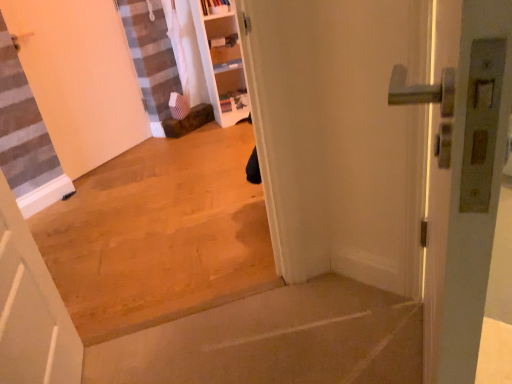
Question: From a real-world perspective, relative to white matte door at lower left, the second door from the right, is white matte door at left, positioned as the 1th door in left-to-right order, vertically above or below?

Choices:
 (A) above
 (B) below

Answer: (A)

Question: In terms of size, does white matte door at left, which ranks as the third door in right-to-left order, appear bigger or smaller than white matte door at lower left, which appears as the second door when viewed from the left?

Choices:
 (A) big
 (B) small

Answer: (A)

Question: Based on their relative distances, which object is farther from the white matte door at lower left, which ranks as the third door in back-to-front order?

Choices:
 (A) smooth concrete step at lower center, placed as the first concrete when sorted from bottom to top
 (B) brown wood floor at center, acting as the second concrete starting from the bottom
 (C) metallic silver handle at right, which is counted as the 2th door, starting from the back
 (D) white matte door at left, which ranks as the third door in right-to-left order

Answer: (D)

Question: Considering the real-world distances, which object is farthest from the white matte door at lower left, the second door from the right?

Choices:
 (A) white matte door at left, which ranks as the third door in right-to-left order
 (B) brown wood floor at center, which is the first concrete from top to bottom
 (C) smooth concrete step at lower center, acting as the 2th concrete starting from the top
 (D) metallic silver handle at right, which is the third door from left to right

Answer: (A)